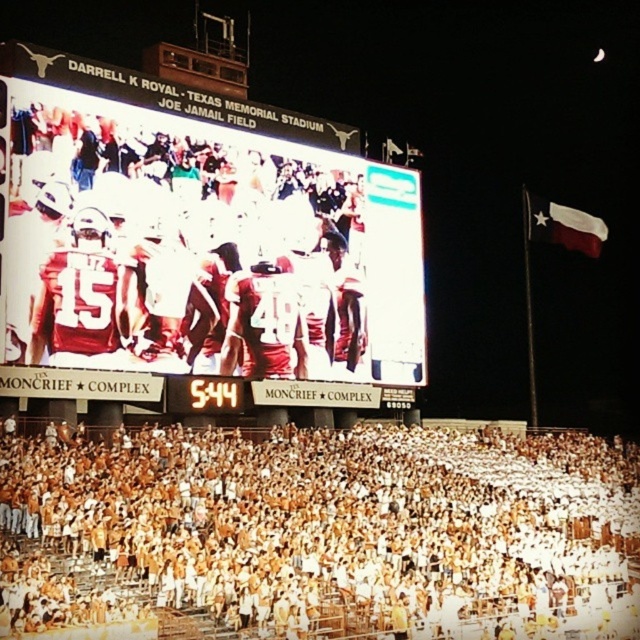
Is white digital scoreboard at upper center further to the viewer compared to white fabric flag at upper right?

No, it is in front of white fabric flag at upper right.

Where is `white digital scoreboard at upper center`? The image size is (640, 640). white digital scoreboard at upper center is located at coordinates (200, 248).

The width and height of the screenshot is (640, 640). Find the location of `white digital scoreboard at upper center`. white digital scoreboard at upper center is located at coordinates (200, 248).

Is point (285, 481) positioned before point (292, 269)?

Yes, point (285, 481) is in front of point (292, 269).

This screenshot has width=640, height=640. Describe the element at coordinates (342, 524) in the screenshot. I see `white fabric crowd at lower center` at that location.

Where is `white fabric crowd at lower center`? This screenshot has width=640, height=640. white fabric crowd at lower center is located at coordinates (342, 524).

Is point (561, 474) positioned before point (525, 212)?

That is True.

Is white fabric crowd at lower center below white fabric flag at upper right?

Yes.

Who is more forward, (154, 564) or (580, 224)?

Point (154, 564) is in front.

Where is `white fabric crowd at lower center`? white fabric crowd at lower center is located at coordinates (342, 524).